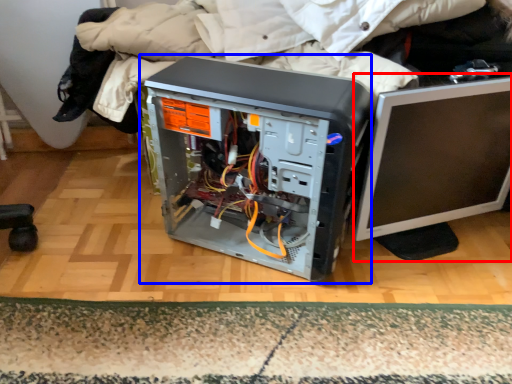
Question: Among these objects, which one is farthest to the camera, computer monitor (highlighted by a red box) or computer tower (highlighted by a blue box)?

Choices:
 (A) computer monitor
 (B) computer tower

Answer: (A)